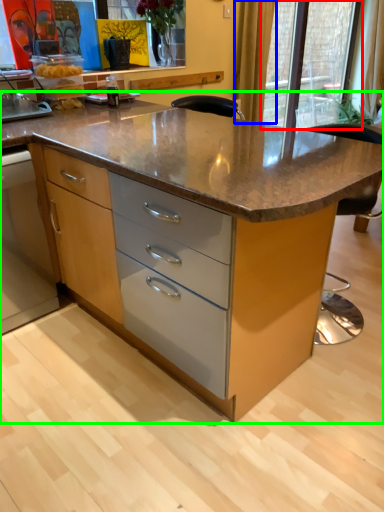
Question: Based on their relative distances, which object is nearer to glass door (highlighted by a red box)? Choose from curtain (highlighted by a blue box) and table (highlighted by a green box).

Choices:
 (A) curtain
 (B) table

Answer: (A)